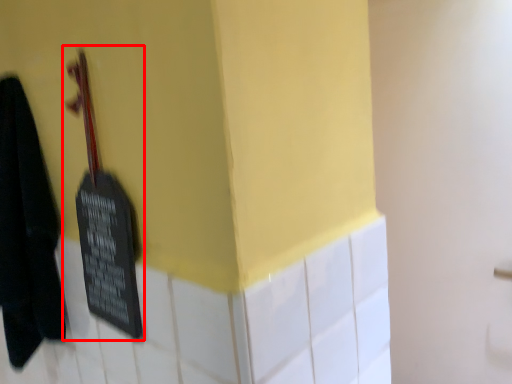
Question: From the image, what is the correct spatial relationship of violin (annotated by the red box) in relation to towel?

Choices:
 (A) right
 (B) left

Answer: (A)